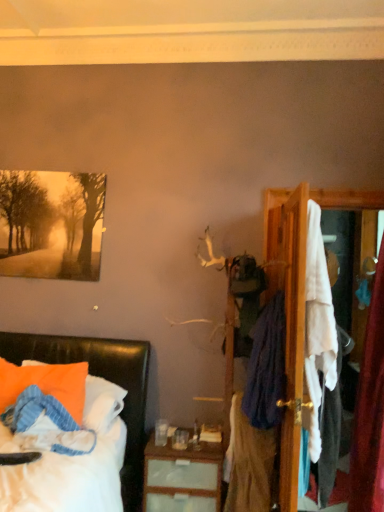
Question: Is matte paper painting at upper left at the left side of wooden dresser at right?

Choices:
 (A) no
 (B) yes

Answer: (B)

Question: From the image's perspective, is matte paper painting at upper left over wooden dresser at right?

Choices:
 (A) no
 (B) yes

Answer: (B)

Question: Considering the relative positions of matte paper painting at upper left and wooden dresser at right in the image provided, is matte paper painting at upper left in front of wooden dresser at right?

Choices:
 (A) yes
 (B) no

Answer: (B)

Question: Is the surface of matte paper painting at upper left in direct contact with wooden dresser at right?

Choices:
 (A) no
 (B) yes

Answer: (A)

Question: Is matte paper painting at upper left further to the viewer compared to wooden dresser at right?

Choices:
 (A) no
 (B) yes

Answer: (B)

Question: From the image's perspective, relative to matte black bed at lower left, is matte paper painting at upper left above or below?

Choices:
 (A) below
 (B) above

Answer: (B)

Question: Choose the correct answer: Is matte paper painting at upper left inside matte black bed at lower left or outside it?

Choices:
 (A) outside
 (B) inside

Answer: (A)

Question: From a real-world perspective, is matte paper painting at upper left positioned above or below matte black bed at lower left?

Choices:
 (A) below
 (B) above

Answer: (B)

Question: Considering their positions, is matte paper painting at upper left located in front of or behind matte black bed at lower left?

Choices:
 (A) front
 (B) behind

Answer: (B)

Question: Considering the positions of point pyautogui.click(x=139, y=450) and point pyautogui.click(x=264, y=357), is point pyautogui.click(x=139, y=450) closer or farther from the camera than point pyautogui.click(x=264, y=357)?

Choices:
 (A) farther
 (B) closer

Answer: (A)

Question: From a real-world perspective, is matte black bed at lower left positioned above or below dark blue fabric at right, the 1th clothing positioned from the top?

Choices:
 (A) above
 (B) below

Answer: (B)

Question: Is matte black bed at lower left in front of or behind dark blue fabric at right, the second clothing when ordered from bottom to top, in the image?

Choices:
 (A) front
 (B) behind

Answer: (A)

Question: From the image's perspective, is matte black bed at lower left above or below dark blue fabric at right, the second clothing when ordered from bottom to top?

Choices:
 (A) below
 (B) above

Answer: (A)

Question: Based on their sizes in the image, would you say velvety purple scarf at right, the second clothing when ordered from top to bottom, is bigger or smaller than matte black bed at lower left?

Choices:
 (A) small
 (B) big

Answer: (A)

Question: Is velvety purple scarf at right, the second clothing when ordered from top to bottom, inside the boundaries of matte black bed at lower left, or outside?

Choices:
 (A) outside
 (B) inside

Answer: (A)